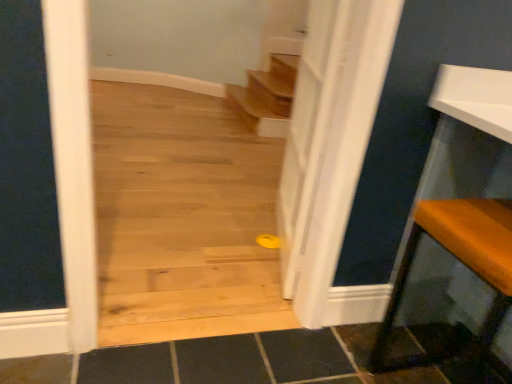
The image size is (512, 384). I want to click on vacant area that is in front of white glossy door at center, so click(248, 298).